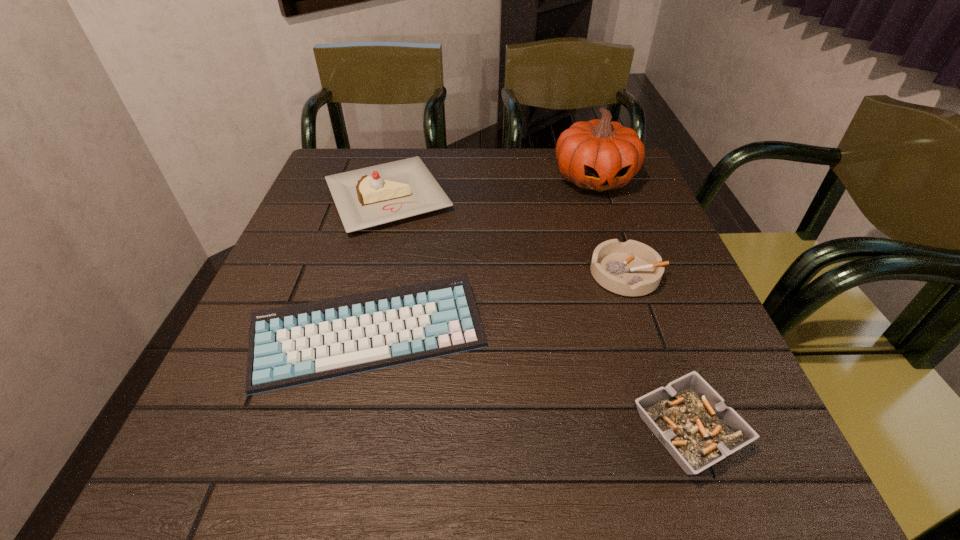
The image size is (960, 540). I want to click on pumpkin, so tap(599, 155).

Where is `cake`? This screenshot has height=540, width=960. cake is located at coordinates (371, 196).

The image size is (960, 540). In order to click on the farther ashtray in this screenshot , I will do `click(631, 268)`.

This screenshot has height=540, width=960. I want to click on computer keyboard, so click(x=297, y=344).

Identify the location of the nearer ashtray. The width and height of the screenshot is (960, 540). (690, 419).

Locate an element on the screen. Image resolution: width=960 pixels, height=540 pixels. free region located on the face of the pumpkin is located at coordinates (613, 235).

Image resolution: width=960 pixels, height=540 pixels. What are the coordinates of `vacant space located 0.300m on the right of the cake` in the screenshot? It's located at (573, 197).

Identify the location of free point located on the front of the farther ashtray. The image size is (960, 540). (642, 318).

Find the location of `vacant area located 0.070m on the right of the computer keyboard`. vacant area located 0.070m on the right of the computer keyboard is located at coordinates (525, 335).

Where is `vacant space located on the back of the nearer ashtray`? vacant space located on the back of the nearer ashtray is located at coordinates (629, 265).